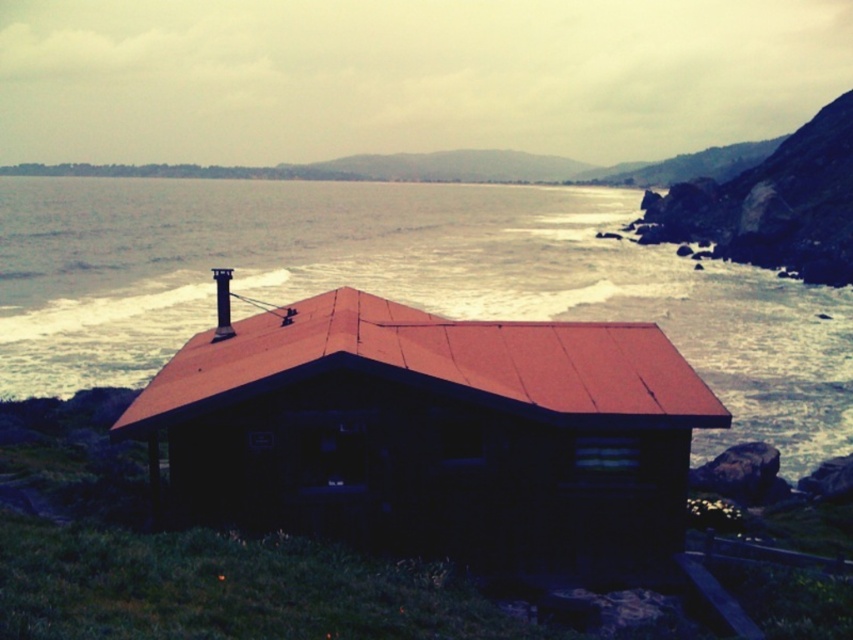
Question: Is oily gray water at center smaller than wooden log cabin at center?

Choices:
 (A) yes
 (B) no

Answer: (B)

Question: Which of the following is the farthest from the observer?

Choices:
 (A) (244, 460)
 (B) (494, 236)

Answer: (B)

Question: Can you confirm if oily gray water at center is positioned to the left of wooden log cabin at center?

Choices:
 (A) no
 (B) yes

Answer: (B)

Question: Among these points, which one is nearest to the camera?

Choices:
 (A) (582, 246)
 (B) (350, 540)

Answer: (B)

Question: Among these points, which one is farthest from the camera?

Choices:
 (A) (762, 400)
 (B) (675, 525)

Answer: (A)

Question: Can you confirm if oily gray water at center is positioned to the left of wooden log cabin at center?

Choices:
 (A) no
 (B) yes

Answer: (B)